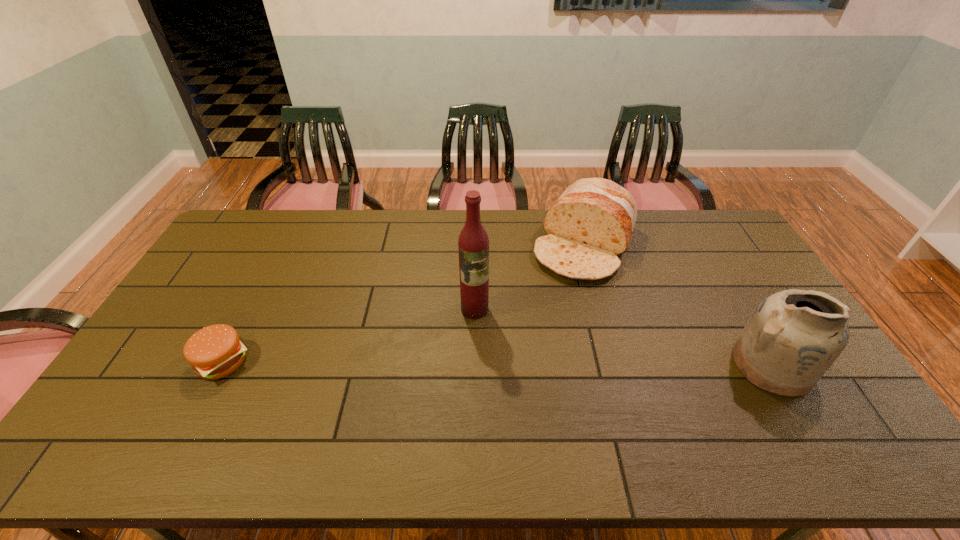
Image resolution: width=960 pixels, height=540 pixels. Identify the location of blank area located on the label of the tallest object. (489, 414).

You are a GUI agent. You are given a task and a screenshot of the screen. Output one action in this format:
    pyautogui.click(x=<x>, y=<y>)
    Task: Click on the free space located 0.270m on the label of the tallest object
    
    Given the screenshot: What is the action you would take?
    pyautogui.click(x=486, y=396)

The width and height of the screenshot is (960, 540). I want to click on vacant space located on the label of the tallest object, so click(x=482, y=362).

Image resolution: width=960 pixels, height=540 pixels. Find the location of `vacant point located 0.150m at the sliced end of the second shortest object`. vacant point located 0.150m at the sliced end of the second shortest object is located at coordinates (553, 310).

The height and width of the screenshot is (540, 960). In order to click on free space located 0.120m at the sliced end of the second shortest object in this screenshot , I will do `click(556, 305)`.

The height and width of the screenshot is (540, 960). I want to click on free location located at the sliced end of the second shortest object, so click(554, 308).

Identify the location of object present at the far edge. The width and height of the screenshot is (960, 540). (592, 222).

Locate an element on the screen. Image resolution: width=960 pixels, height=540 pixels. object that is at the near edge is located at coordinates (794, 336).

Find the location of `object positioned at the left edge`. object positioned at the left edge is located at coordinates (215, 351).

The image size is (960, 540). In order to click on object present at the right edge in this screenshot , I will do `click(794, 336)`.